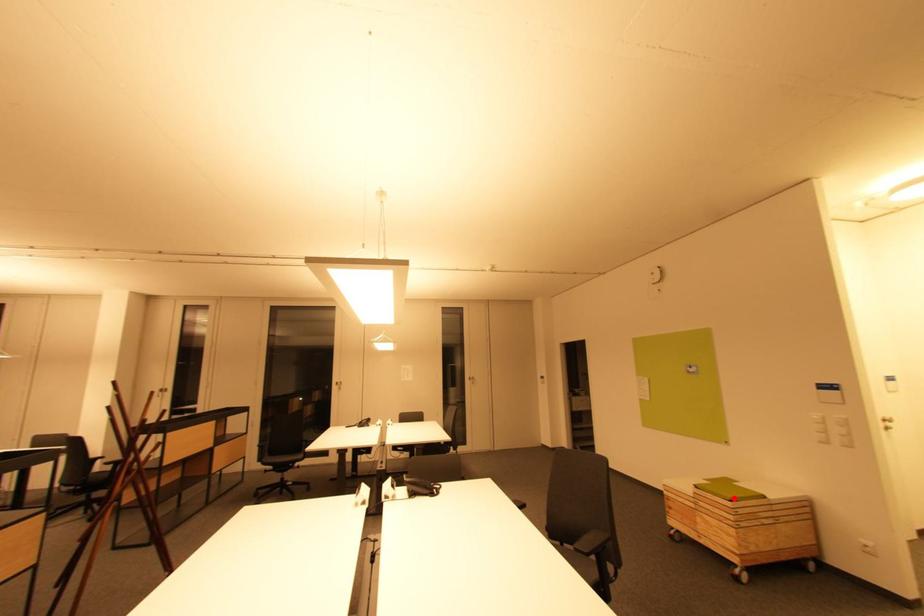
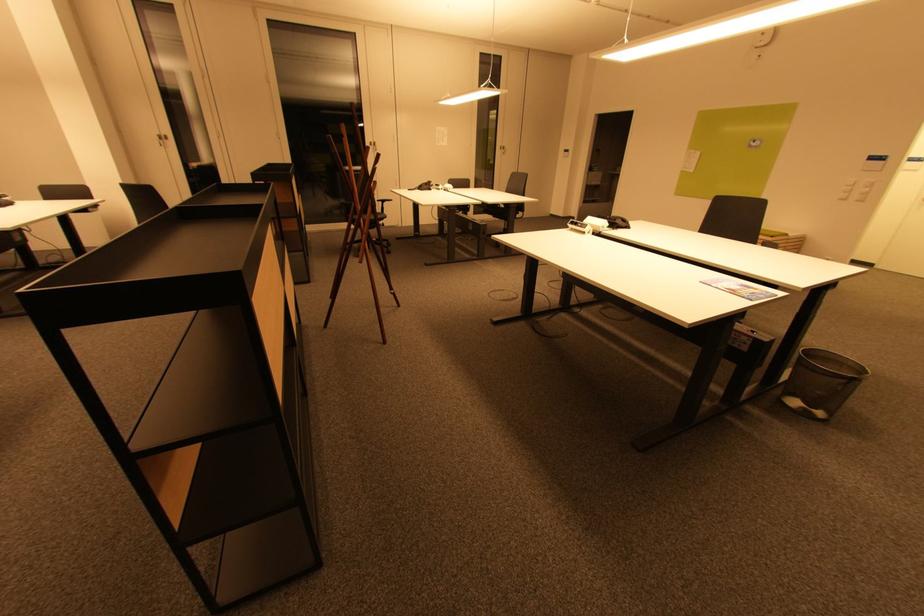
Locate, in the second image, the point that corresponds to the highlighted location in the first image.

(775, 236)